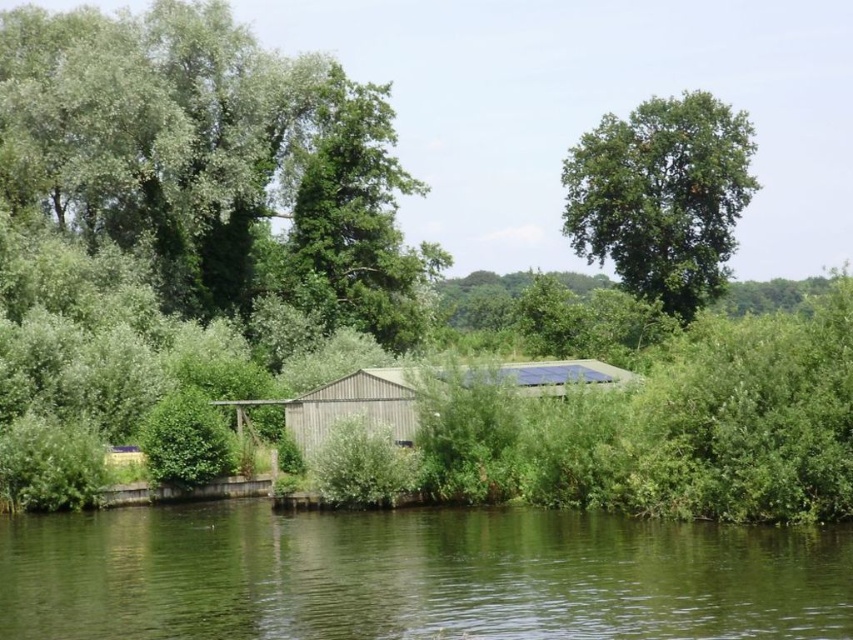
Question: Does green smooth water at center have a greater width compared to wooden shed at center?

Choices:
 (A) no
 (B) yes

Answer: (B)

Question: Among these points, which one is nearest to the camera?

Choices:
 (A) (683, 291)
 (B) (61, 588)

Answer: (B)

Question: Does green smooth water at center come behind green leafy tree at upper right?

Choices:
 (A) yes
 (B) no

Answer: (B)

Question: Based on their relative distances, which object is nearer to the green smooth water at center?

Choices:
 (A) wooden shed at center
 (B) green leafy tree at upper right

Answer: (A)

Question: Which point is closer to the camera taking this photo?

Choices:
 (A) (357, 406)
 (B) (679, 150)

Answer: (A)

Question: Where is green smooth water at center located in relation to wooden shed at center in the image?

Choices:
 (A) right
 (B) left

Answer: (B)